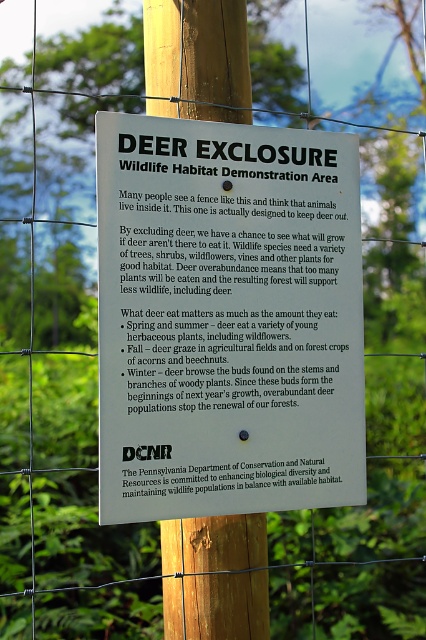
You are a hiker who wants to read the white paper sign at center. You notice the wooden post at center is in your way. Can you move around the post to read the sign without touching the fence?

The white paper sign at center might be wider than wooden post at center. If the sign is wider, it could extend beyond the post on both sides, allowing you to read it from either side without touching the fence. However, if the post is narrower, you might need to step around it to access the sign. Since the sign might be wider, there is a possibility to read it without moving the post.